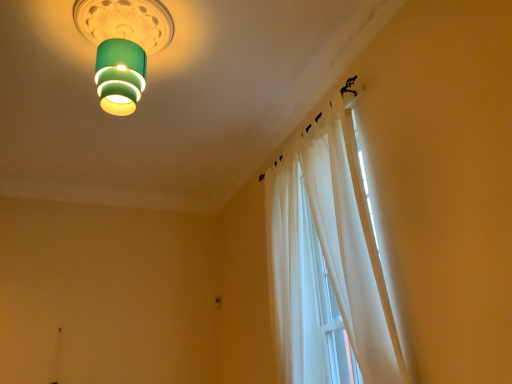
Question: Could white sheer curtain at upper right be considered to be inside green matte lampshade at upper center?

Choices:
 (A) no
 (B) yes

Answer: (A)

Question: Is green matte lampshade at upper center thinner than white sheer curtain at upper right?

Choices:
 (A) no
 (B) yes

Answer: (A)

Question: From a real-world perspective, is green matte lampshade at upper center located higher than white sheer curtain at upper right?

Choices:
 (A) yes
 (B) no

Answer: (A)

Question: From the image's perspective, would you say green matte lampshade at upper center is positioned over white sheer curtain at upper right?

Choices:
 (A) yes
 (B) no

Answer: (A)

Question: Considering the relative sizes of green matte lampshade at upper center and white sheer curtain at upper right in the image provided, is green matte lampshade at upper center taller than white sheer curtain at upper right?

Choices:
 (A) no
 (B) yes

Answer: (A)

Question: Is green matte lampshade at upper center next to white sheer curtain at upper right and touching it?

Choices:
 (A) no
 (B) yes

Answer: (A)

Question: Is the depth of white sheer curtain at upper right greater than that of green matte lampshade at upper center?

Choices:
 (A) no
 (B) yes

Answer: (A)

Question: Does white sheer curtain at upper right appear on the left side of green matte lampshade at upper center?

Choices:
 (A) no
 (B) yes

Answer: (A)

Question: Are white sheer curtain at upper right and green matte lampshade at upper center far apart?

Choices:
 (A) no
 (B) yes

Answer: (B)

Question: Can you confirm if white sheer curtain at upper right is thinner than green matte lampshade at upper center?

Choices:
 (A) no
 (B) yes

Answer: (B)

Question: From a real-world perspective, is white sheer curtain at upper right positioned under green matte lampshade at upper center based on gravity?

Choices:
 (A) yes
 (B) no

Answer: (A)

Question: Is white sheer curtain at upper right wider than green matte lampshade at upper center?

Choices:
 (A) no
 (B) yes

Answer: (A)

Question: In terms of size, does green matte lampshade at upper center appear bigger or smaller than white sheer curtain at upper right?

Choices:
 (A) small
 (B) big

Answer: (A)